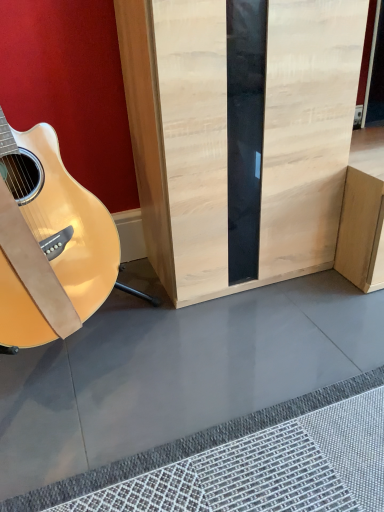
Where is `vacant area that is in front of natural wood cabinet at center`? The width and height of the screenshot is (384, 512). vacant area that is in front of natural wood cabinet at center is located at coordinates (277, 339).